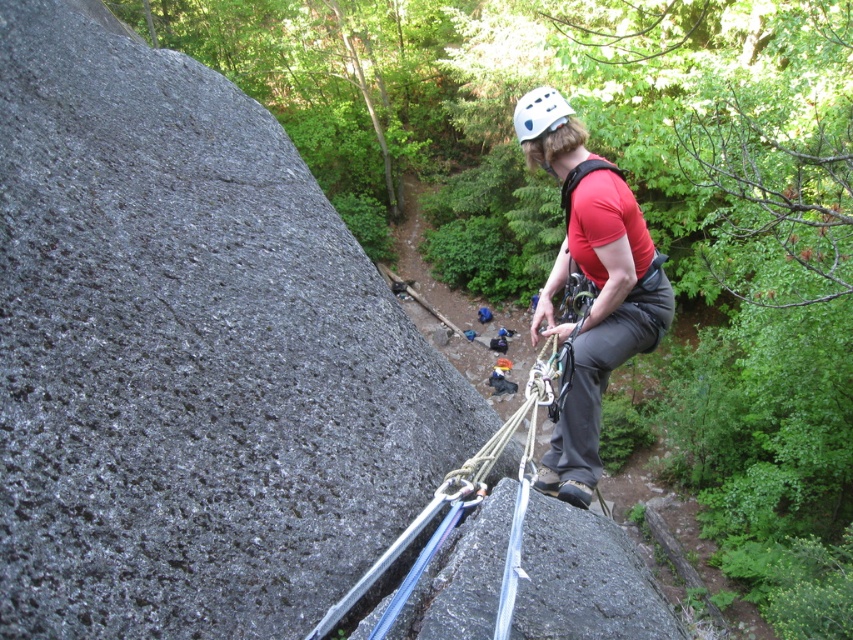
Question: Does matte red shirt at center have a lesser width compared to white matte helmet at upper center?

Choices:
 (A) no
 (B) yes

Answer: (A)

Question: Estimate the real-world distances between objects in this image. Which object is farther from the white matte helmet at upper center?

Choices:
 (A) matte red shirt at center
 (B) smooth granite rock at center

Answer: (B)

Question: Can you confirm if smooth granite rock at center is thinner than matte red shirt at center?

Choices:
 (A) yes
 (B) no

Answer: (B)

Question: Estimate the real-world distances between objects in this image. Which object is farther from the matte red shirt at center?

Choices:
 (A) white matte helmet at upper center
 (B) smooth granite rock at center

Answer: (B)

Question: Which object appears farthest from the camera in this image?

Choices:
 (A) smooth granite rock at center
 (B) white matte helmet at upper center
 (C) matte red shirt at center

Answer: (B)

Question: Observing the image, what is the correct spatial positioning of matte red shirt at center in reference to white matte helmet at upper center?

Choices:
 (A) left
 (B) right

Answer: (B)